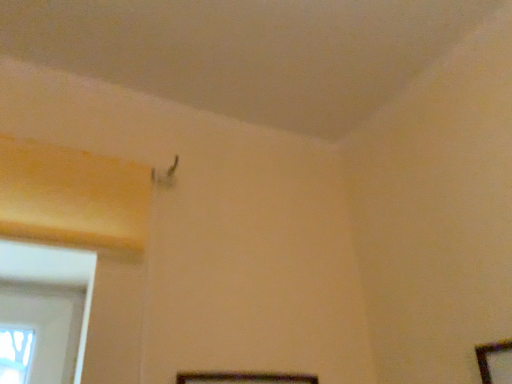
What is the approximate height of wooden picture frame at lower center, which appears as the first picture frame when viewed from the left?

The height of wooden picture frame at lower center, which appears as the first picture frame when viewed from the left, is 9.95 inches.

What is the approximate width of wooden picture frame at lower center, the second picture frame from the right?

The width of wooden picture frame at lower center, the second picture frame from the right, is 0.75 inches.

The width and height of the screenshot is (512, 384). Find the location of `wooden picture frame at lower center, the second picture frame from the right`. wooden picture frame at lower center, the second picture frame from the right is located at coordinates (x=244, y=378).

This screenshot has width=512, height=384. What do you see at coordinates (244, 378) in the screenshot? I see `wooden picture frame at lower center, the second picture frame from the right` at bounding box center [244, 378].

The image size is (512, 384). In order to click on wooden picture frame at lower right, the second picture frame positioned from the left in this screenshot , I will do `click(487, 357)`.

What do you see at coordinates (487, 357) in the screenshot? I see `wooden picture frame at lower right, the 1th picture frame from the right` at bounding box center [487, 357].

Where is `wooden picture frame at lower center, the second picture frame from the right`? wooden picture frame at lower center, the second picture frame from the right is located at coordinates (244, 378).

Is wooden picture frame at lower center, which appears as the first picture frame when viewed from the left, at the left side of wooden picture frame at lower right, the 1th picture frame from the right?

Yes.

Who is more distant, wooden picture frame at lower center, which appears as the first picture frame when viewed from the left, or wooden picture frame at lower right, the 1th picture frame from the right?

Positioned behind is wooden picture frame at lower center, which appears as the first picture frame when viewed from the left.

Considering the positions of point (180, 379) and point (488, 351), is point (180, 379) closer or farther from the camera than point (488, 351)?

Clearly, point (180, 379) is more distant from the camera than point (488, 351).

From the image's perspective, which is above, wooden picture frame at lower center, the second picture frame from the right, or wooden picture frame at lower right, the 1th picture frame from the right?

wooden picture frame at lower right, the 1th picture frame from the right, is shown above in the image.

From a real-world perspective, relative to wooden picture frame at lower right, the 1th picture frame from the right, is wooden picture frame at lower center, the second picture frame from the right, vertically above or below?

In terms of real-world spatial position, wooden picture frame at lower center, the second picture frame from the right, is below wooden picture frame at lower right, the 1th picture frame from the right.

Considering the sizes of wooden picture frame at lower center, the second picture frame from the right, and wooden picture frame at lower right, the 1th picture frame from the right, in the image, is wooden picture frame at lower center, the second picture frame from the right, wider or thinner than wooden picture frame at lower right, the 1th picture frame from the right,?

Clearly, wooden picture frame at lower center, the second picture frame from the right, has less width compared to wooden picture frame at lower right, the 1th picture frame from the right.

Considering the relative sizes of wooden picture frame at lower center, which appears as the first picture frame when viewed from the left, and wooden picture frame at lower right, the second picture frame positioned from the left, in the image provided, is wooden picture frame at lower center, which appears as the first picture frame when viewed from the left, shorter than wooden picture frame at lower right, the second picture frame positioned from the left,?

Correct, wooden picture frame at lower center, which appears as the first picture frame when viewed from the left, is not as tall as wooden picture frame at lower right, the second picture frame positioned from the left.

Based on the photo, considering the relative sizes of wooden picture frame at lower center, which appears as the first picture frame when viewed from the left, and wooden picture frame at lower right, the second picture frame positioned from the left, in the image provided, is wooden picture frame at lower center, which appears as the first picture frame when viewed from the left, bigger than wooden picture frame at lower right, the second picture frame positioned from the left,?

Answer: Incorrect, wooden picture frame at lower center, which appears as the first picture frame when viewed from the left, is not larger than wooden picture frame at lower right, the second picture frame positioned from the left.

Is wooden picture frame at lower center, the second picture frame from the right, completely or partially outside of wooden picture frame at lower right, the second picture frame positioned from the left?

wooden picture frame at lower center, the second picture frame from the right, lies outside wooden picture frame at lower right, the second picture frame positioned from the left,'s area.

Are wooden picture frame at lower center, which appears as the first picture frame when viewed from the left, and wooden picture frame at lower right, the 1th picture frame from the right, making contact?

No, wooden picture frame at lower center, which appears as the first picture frame when viewed from the left, is not touching wooden picture frame at lower right, the 1th picture frame from the right.

Is wooden picture frame at lower center, the second picture frame from the right, facing towards wooden picture frame at lower right, the second picture frame positioned from the left?

Yes.

How many degrees apart are the facing directions of wooden picture frame at lower center, the second picture frame from the right, and wooden picture frame at lower right, the second picture frame positioned from the left?

87.3 degrees.

At what (x,y) coordinates should I click in order to perform the action: click on picture frame on the right side of wooden picture frame at lower center, the second picture frame from the right. Please return your answer as a coordinate pair (x, y). The image size is (512, 384). Looking at the image, I should click on tap(487, 357).

Between wooden picture frame at lower right, the second picture frame positioned from the left, and wooden picture frame at lower center, which appears as the first picture frame when viewed from the left, which one appears on the left side from the viewer's perspective?

From the viewer's perspective, wooden picture frame at lower center, which appears as the first picture frame when viewed from the left, appears more on the left side.

Consider the image. Is the depth of wooden picture frame at lower right, the 1th picture frame from the right, greater than that of wooden picture frame at lower center, the second picture frame from the right?

No, the depth of wooden picture frame at lower right, the 1th picture frame from the right, is less than that of wooden picture frame at lower center, the second picture frame from the right.

Does point (482, 379) come farther from viewer compared to point (221, 376)?

No, it is not.

Looking at this image, from the image's perspective, is wooden picture frame at lower right, the second picture frame positioned from the left, above wooden picture frame at lower center, the second picture frame from the right?

Yes.

Based on the photo, from a real-world perspective, which is physically below, wooden picture frame at lower right, the second picture frame positioned from the left, or wooden picture frame at lower center, which appears as the first picture frame when viewed from the left?

wooden picture frame at lower center, which appears as the first picture frame when viewed from the left.

Does wooden picture frame at lower right, the second picture frame positioned from the left, have a greater width compared to wooden picture frame at lower center, which appears as the first picture frame when viewed from the left?

Indeed, wooden picture frame at lower right, the second picture frame positioned from the left, has a greater width compared to wooden picture frame at lower center, which appears as the first picture frame when viewed from the left.

Considering the sizes of wooden picture frame at lower right, the second picture frame positioned from the left, and wooden picture frame at lower center, which appears as the first picture frame when viewed from the left, in the image, is wooden picture frame at lower right, the second picture frame positioned from the left, taller or shorter than wooden picture frame at lower center, which appears as the first picture frame when viewed from the left,?

wooden picture frame at lower right, the second picture frame positioned from the left, is taller than wooden picture frame at lower center, which appears as the first picture frame when viewed from the left.

Does wooden picture frame at lower right, the second picture frame positioned from the left, have a larger size compared to wooden picture frame at lower center, the second picture frame from the right?

Correct, wooden picture frame at lower right, the second picture frame positioned from the left, is larger in size than wooden picture frame at lower center, the second picture frame from the right.

Is wooden picture frame at lower right, the second picture frame positioned from the left, completely or partially outside of wooden picture frame at lower center, the second picture frame from the right?

Yes, wooden picture frame at lower right, the second picture frame positioned from the left, is outside of wooden picture frame at lower center, the second picture frame from the right.

Is wooden picture frame at lower right, the 1th picture frame from the right, with wooden picture frame at lower center, the second picture frame from the right?

wooden picture frame at lower right, the 1th picture frame from the right, is not next to wooden picture frame at lower center, the second picture frame from the right, and they're not touching.

Is wooden picture frame at lower right, the 1th picture frame from the right, oriented towards wooden picture frame at lower center, which appears as the first picture frame when viewed from the left?

No, wooden picture frame at lower right, the 1th picture frame from the right, is not turned towards wooden picture frame at lower center, which appears as the first picture frame when viewed from the left.

What's the angular difference between wooden picture frame at lower right, the second picture frame positioned from the left, and wooden picture frame at lower center, which appears as the first picture frame when viewed from the left,'s facing directions?

The angular difference between wooden picture frame at lower right, the second picture frame positioned from the left, and wooden picture frame at lower center, which appears as the first picture frame when viewed from the left, is 87.3 degrees.

How much distance is there between wooden picture frame at lower right, the second picture frame positioned from the left, and wooden picture frame at lower center, the second picture frame from the right?

A distance of 17.29 inches exists between wooden picture frame at lower right, the second picture frame positioned from the left, and wooden picture frame at lower center, the second picture frame from the right.

What are the coordinates of `picture frame above the wooden picture frame at lower center, the second picture frame from the right (from the image's perspective)` in the screenshot? It's located at (487, 357).

Image resolution: width=512 pixels, height=384 pixels. Identify the location of picture frame that appears in front of the wooden picture frame at lower center, the second picture frame from the right. (487, 357).

Find the location of a particular element. The width and height of the screenshot is (512, 384). picture frame positioned vertically above the wooden picture frame at lower center, which appears as the first picture frame when viewed from the left (from a real-world perspective) is located at coordinates (487, 357).